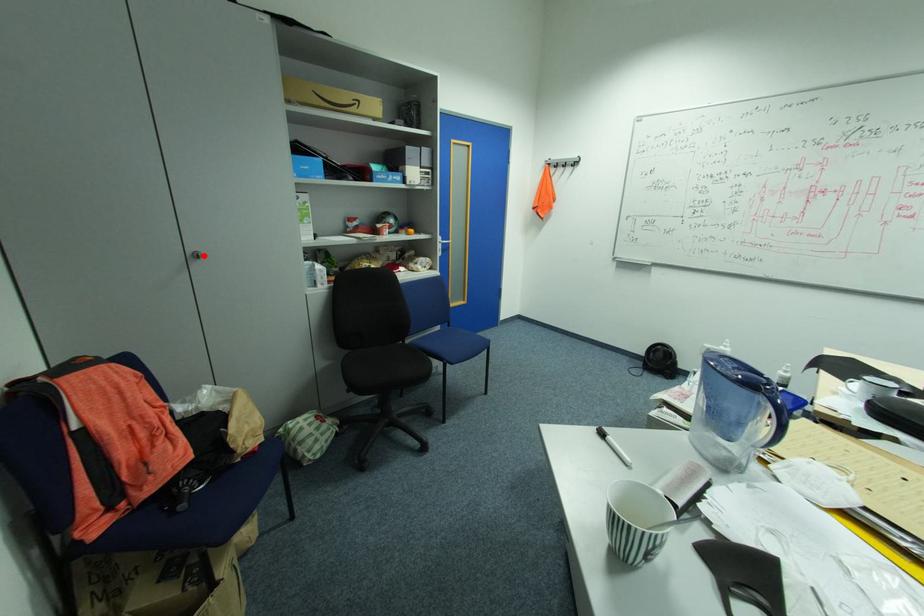
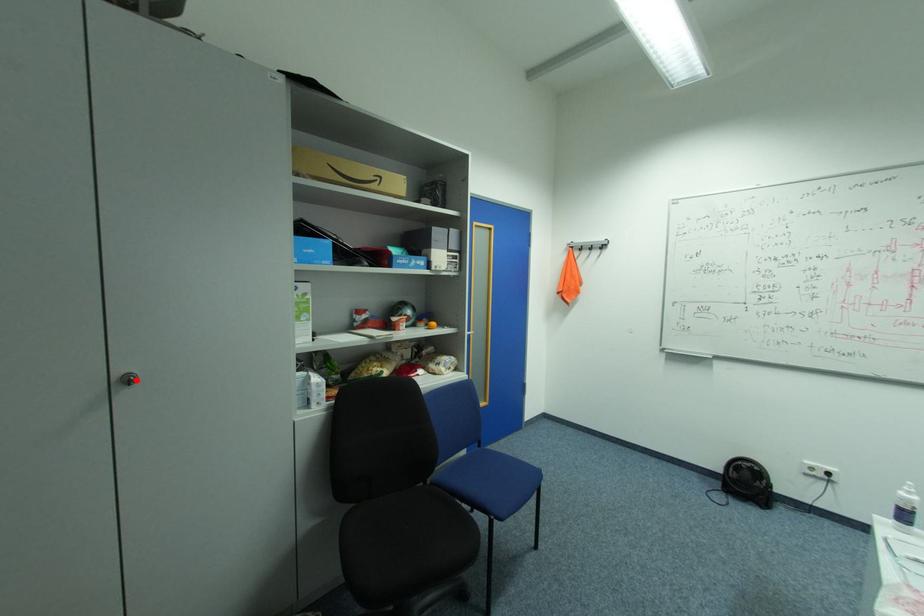
I am providing you with two images of the same scene from different viewpoints. A red point is marked on the first image and another point is marked on the second image. Are the points marked in image1 and image2 representing the same 3D position?

Yes